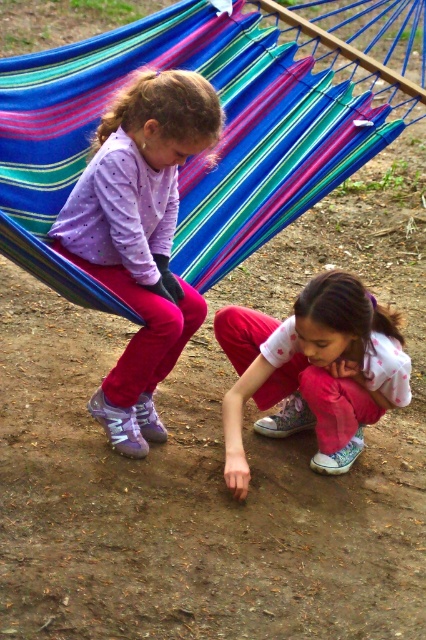
Question: Does multicolored striped hammock at upper center have a greater width compared to purple matte shirt at upper left?

Choices:
 (A) yes
 (B) no

Answer: (B)

Question: Does multicolored striped hammock at upper center have a lesser width compared to purple matte shirt at upper left?

Choices:
 (A) yes
 (B) no

Answer: (A)

Question: Which of the following is the farthest from the observer?

Choices:
 (A) pink cotton pants at lower center
 (B) purple matte shirt at upper left

Answer: (A)

Question: Which object appears closest to the camera in this image?

Choices:
 (A) purple matte shirt at upper left
 (B) multicolored striped hammock at upper center

Answer: (A)

Question: Which of the following is the closest to the observer?

Choices:
 (A) (155, 300)
 (B) (69, 93)

Answer: (A)

Question: Where is multicolored striped hammock at upper center located in relation to purple matte shirt at upper left in the image?

Choices:
 (A) above
 (B) below

Answer: (A)